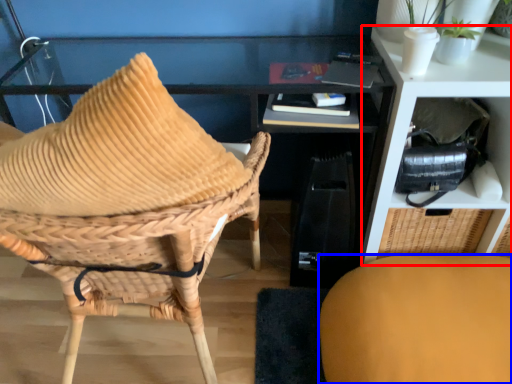
Question: Which object appears farthest to the camera in this image, shelf (highlighted by a red box) or chair (highlighted by a blue box)?

Choices:
 (A) shelf
 (B) chair

Answer: (A)